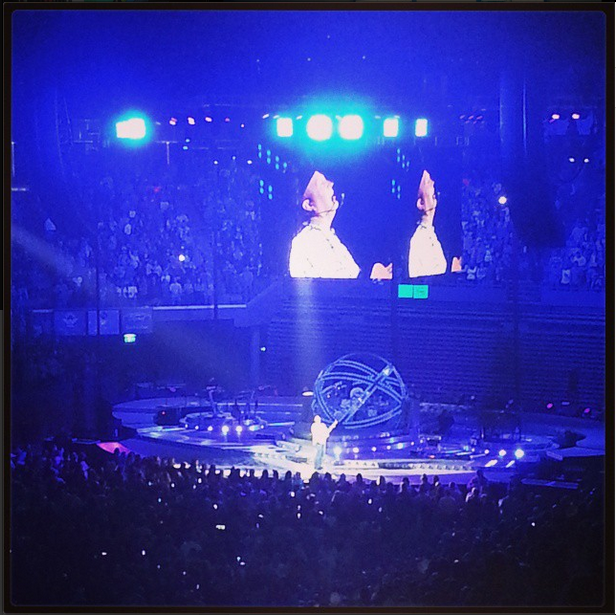
This screenshot has width=616, height=615. What are the coordinates of `stage` in the screenshot? It's located at (342, 449).